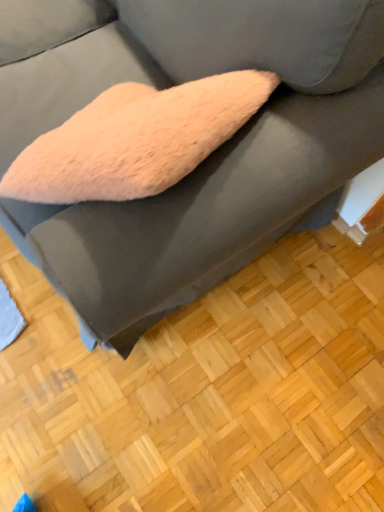
Find the location of `fuzzy pink pillow at center`. fuzzy pink pillow at center is located at coordinates (205, 160).

Describe the element at coordinates (205, 160) in the screenshot. I see `fuzzy pink pillow at center` at that location.

In order to face fuzzy pink pillow at center, should I rotate leftwards or rightwards?

You should rotate left by 16.224 degrees.

Measure the distance between light brown wood flooring at lower center and camera.

The depth of light brown wood flooring at lower center is 1.08 meters.

Image resolution: width=384 pixels, height=512 pixels. Find the location of `light brown wood flooring at lower center`. light brown wood flooring at lower center is located at coordinates (206, 393).

What do you see at coordinates (206, 393) in the screenshot?
I see `light brown wood flooring at lower center` at bounding box center [206, 393].

The height and width of the screenshot is (512, 384). I want to click on fuzzy pink pillow at center, so click(x=205, y=160).

Consider the image. Is light brown wood flooring at lower center to the left of fuzzy pink pillow at center from the viewer's perspective?

In fact, light brown wood flooring at lower center is to the right of fuzzy pink pillow at center.

Is light brown wood flooring at lower center in front of or behind fuzzy pink pillow at center in the image?

Visually, light brown wood flooring at lower center is located behind fuzzy pink pillow at center.

Does point (352, 495) lie in front of point (218, 47)?

No, (352, 495) is behind (218, 47).

In the scene shown: From the image's perspective, relative to fuzzy pink pillow at center, is light brown wood flooring at lower center above or below?

Based on their image positions, light brown wood flooring at lower center is located beneath fuzzy pink pillow at center.

From a real-world perspective, does light brown wood flooring at lower center sit lower than fuzzy pink pillow at center?

Correct, in the physical world, light brown wood flooring at lower center is lower than fuzzy pink pillow at center.

Can you confirm if light brown wood flooring at lower center is wider than fuzzy pink pillow at center?

Yes.

Based on the photo, can you confirm if light brown wood flooring at lower center is taller than fuzzy pink pillow at center?

No.

Based on the photo, which of these two, light brown wood flooring at lower center or fuzzy pink pillow at center, is bigger?

Bigger between the two is fuzzy pink pillow at center.

Is light brown wood flooring at lower center inside the boundaries of fuzzy pink pillow at center, or outside?

The correct answer is: outside.

Would you say light brown wood flooring at lower center is a long distance from fuzzy pink pillow at center?

They are positioned close to each other.

From the picture: Could you tell me if light brown wood flooring at lower center is turned towards fuzzy pink pillow at center?

No, light brown wood flooring at lower center does not turn towards fuzzy pink pillow at center.

Can you tell me how much light brown wood flooring at lower center and fuzzy pink pillow at center differ in facing direction?

The angle between the facing direction of light brown wood flooring at lower center and the facing direction of fuzzy pink pillow at center is 179 degrees.

Measure the distance from light brown wood flooring at lower center to fuzzy pink pillow at center.

light brown wood flooring at lower center and fuzzy pink pillow at center are 23.24 inches apart from each other.

The image size is (384, 512). What are the coordinates of `hardwood located on the right of fuzzy pink pillow at center` in the screenshot? It's located at (206, 393).

Is fuzzy pink pillow at center to the left or to the right of light brown wood flooring at lower center in the image?

fuzzy pink pillow at center is to the left of light brown wood flooring at lower center.

Which object is closer to the camera taking this photo, fuzzy pink pillow at center or light brown wood flooring at lower center?

fuzzy pink pillow at center is closer to the camera.

Is point (253, 180) closer or farther from the camera than point (272, 307)?

Point (253, 180) is positioned closer to the camera compared to point (272, 307).

From the picture: From the image's perspective, is fuzzy pink pillow at center over light brown wood flooring at lower center?

Yes, from the image's perspective, fuzzy pink pillow at center is above light brown wood flooring at lower center.

From a real-world perspective, relative to light brown wood flooring at lower center, is fuzzy pink pillow at center vertically above or below?

From a real-world perspective, fuzzy pink pillow at center is physically above light brown wood flooring at lower center.

Consider the image. Which object is wider, fuzzy pink pillow at center or light brown wood flooring at lower center?

light brown wood flooring at lower center is wider.

Is fuzzy pink pillow at center taller than light brown wood flooring at lower center?

Indeed, fuzzy pink pillow at center has a greater height compared to light brown wood flooring at lower center.

Can you confirm if fuzzy pink pillow at center is smaller than light brown wood flooring at lower center?

No.

From the picture: Would you say fuzzy pink pillow at center is inside or outside light brown wood flooring at lower center?

The correct answer is: outside.

Are fuzzy pink pillow at center and light brown wood flooring at lower center beside each other?

No, fuzzy pink pillow at center is not in contact with light brown wood flooring at lower center.

Is fuzzy pink pillow at center looking in the opposite direction of light brown wood flooring at lower center?

No, light brown wood flooring at lower center is not at the back of fuzzy pink pillow at center.

Measure the distance between fuzzy pink pillow at center and light brown wood flooring at lower center.

fuzzy pink pillow at center is 23.24 inches from light brown wood flooring at lower center.

In order to click on studio couch in front of the light brown wood flooring at lower center in this screenshot , I will do `click(205, 160)`.

The image size is (384, 512). I want to click on studio couch that appears in front of the light brown wood flooring at lower center, so click(205, 160).

The image size is (384, 512). In the image, there is a light brown wood flooring at lower center. In order to click on studio couch above it (from the image's perspective) in this screenshot , I will do `click(205, 160)`.